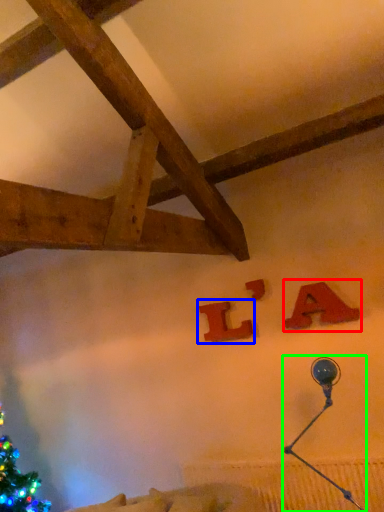
Question: Which object is positioned closest to alphabet (highlighted by a red box)? Select from alphabet (highlighted by a blue box) and lamp (highlighted by a green box).

Choices:
 (A) alphabet
 (B) lamp

Answer: (B)